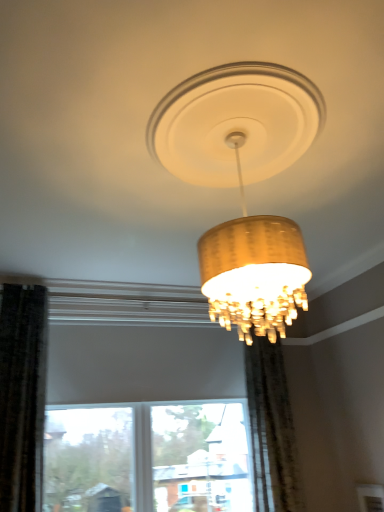
Question: Is sheer beige curtain at center inside or outside of matte gold chandelier at center?

Choices:
 (A) inside
 (B) outside

Answer: (B)

Question: Is sheer beige curtain at center to the left or to the right of matte gold chandelier at center in the image?

Choices:
 (A) right
 (B) left

Answer: (A)

Question: Considering the positions of sheer beige curtain at center and matte gold chandelier at center in the image, is sheer beige curtain at center taller or shorter than matte gold chandelier at center?

Choices:
 (A) tall
 (B) short

Answer: (A)

Question: In terms of width, does matte gold chandelier at center look wider or thinner when compared to sheer beige curtain at center?

Choices:
 (A) wide
 (B) thin

Answer: (A)

Question: Considering the positions of point (223, 65) and point (263, 494), is point (223, 65) closer or farther from the camera than point (263, 494)?

Choices:
 (A) farther
 (B) closer

Answer: (B)

Question: Considering the relative positions of matte gold chandelier at center and sheer beige curtain at center in the image provided, is matte gold chandelier at center to the left or to the right of sheer beige curtain at center?

Choices:
 (A) left
 (B) right

Answer: (A)

Question: From their relative heights in the image, would you say matte gold chandelier at center is taller or shorter than sheer beige curtain at center?

Choices:
 (A) short
 (B) tall

Answer: (A)